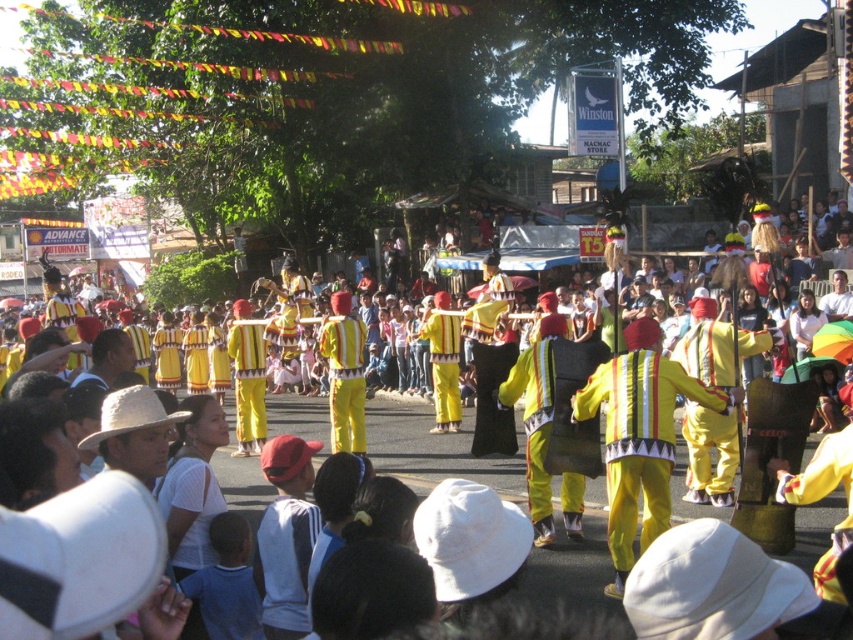
You are a photographer standing at the edge of the parade crowd. You want to take a photo that includes both the yellow fabric costumes at center and the yellow fabric costume at center. Which one will appear larger in your photo?

The yellow fabric costumes at center will appear larger in the photo because it is closer to the viewer than the yellow fabric costume at center.

You are a photographer at the parade and want to capture both the yellow fabric costumes at center and the yellow fabric costume at center in the same frame. Which one should you focus on to ensure the height difference is visible?

The yellow fabric costumes at center is much taller than the yellow fabric costume at center, so focusing on the yellow fabric costumes at center will highlight the height difference.